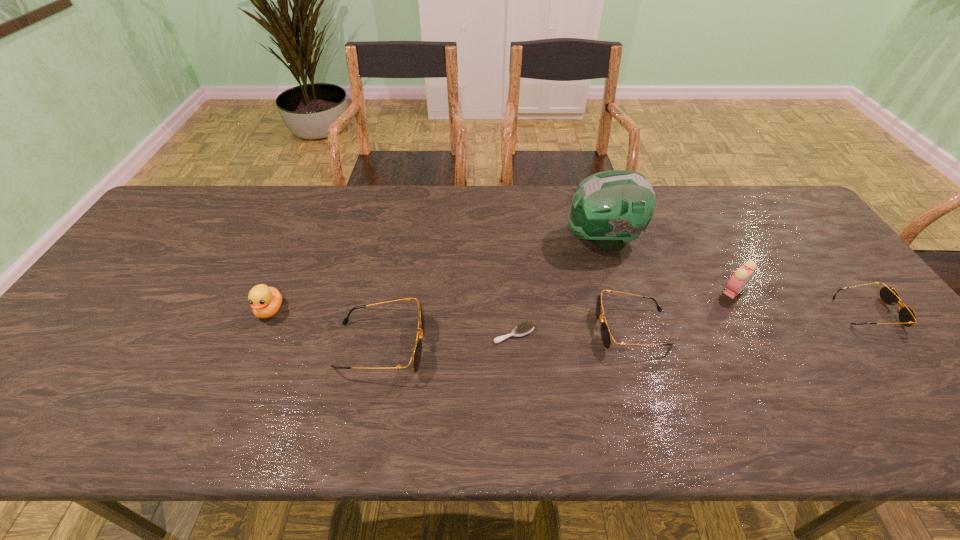
Locate an element on the screen. Image resolution: width=960 pixels, height=540 pixels. vacant space at the near right corner is located at coordinates (874, 364).

At what (x,y) coordinates should I click in order to perform the action: click on blank region between the second shortest object and the second object from right to left. Please return your answer as a coordinate pair (x, y). This screenshot has width=960, height=540. Looking at the image, I should click on pos(801,301).

The image size is (960, 540). What are the coordinates of `unoccupied area between the alarm clock and the third shortest object` in the screenshot? It's located at click(683, 310).

Locate an element on the screen. This screenshot has height=540, width=960. unoccupied position between the leftmost object and the sixth object from right to left is located at coordinates (325, 328).

The height and width of the screenshot is (540, 960). Find the location of `vacant space that's between the second object from right to left and the fourth tallest object`. vacant space that's between the second object from right to left and the fourth tallest object is located at coordinates (558, 319).

Find the location of a particular element. The width and height of the screenshot is (960, 540). free spot between the fifth tallest object and the tallest object is located at coordinates (617, 284).

Locate an element on the screen. This screenshot has height=540, width=960. free space between the duckling and the second object from right to left is located at coordinates (502, 301).

Image resolution: width=960 pixels, height=540 pixels. What are the coordinates of `vacant space that is in between the duckling and the scrubbing brush` in the screenshot? It's located at [393, 322].

Find the location of a particular element. free space between the duckling and the rightmost sunglasses is located at coordinates tap(568, 311).

Where is `free spot between the leftmost object and the tallest object`? The height and width of the screenshot is (540, 960). free spot between the leftmost object and the tallest object is located at coordinates (437, 275).